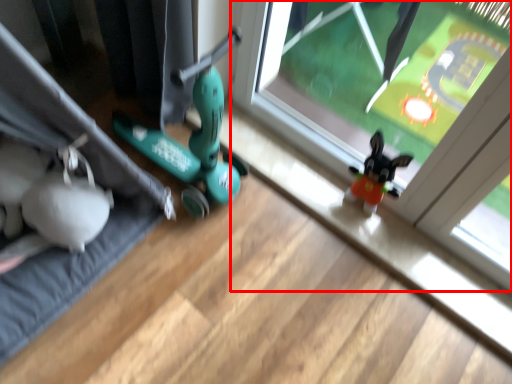
Question: Where is window (annotated by the red box) located in relation to yoga mat in the image?

Choices:
 (A) left
 (B) right

Answer: (B)